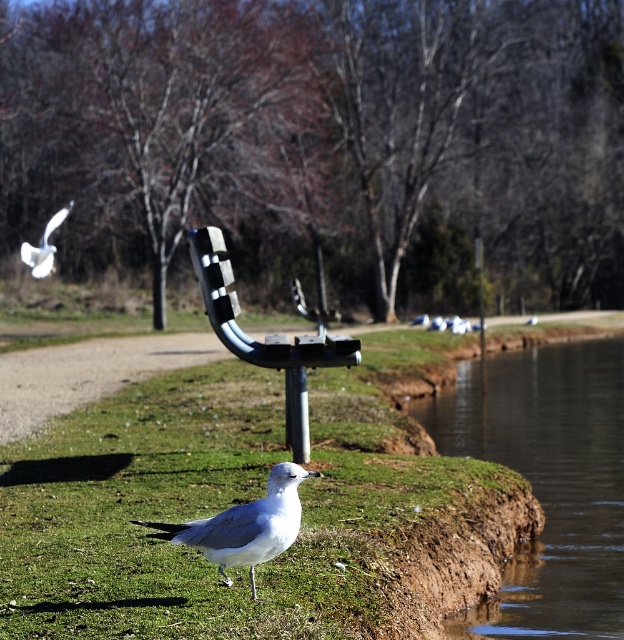
Question: Is green grass at lower center above metallic pole at center?

Choices:
 (A) yes
 (B) no

Answer: (B)

Question: Is brown dirt at lower right positioned behind white matte bird at lower center?

Choices:
 (A) yes
 (B) no

Answer: (A)

Question: Among these objects, which one is nearest to the camera?

Choices:
 (A) white matte bird at lower center
 (B) green grass at lower center

Answer: (B)

Question: Which point appears closest to the camera in this image?

Choices:
 (A) (273, 474)
 (B) (517, 369)
 (C) (156, 368)
 (D) (236, 595)

Answer: (A)

Question: Among these points, which one is nearest to the camera?

Choices:
 (A) (124, 349)
 (B) (280, 490)

Answer: (B)

Question: Can you confirm if brown dirt at lower right is positioned to the right of white matte bird at lower center?

Choices:
 (A) yes
 (B) no

Answer: (A)